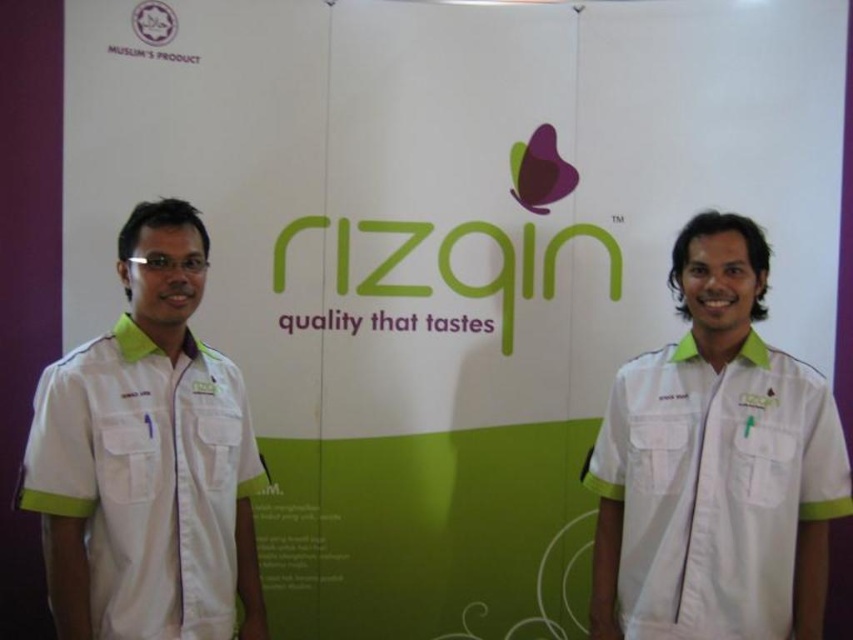
Looking at this image, you are a photographer adjusting your camera to focus on the white fabric shirt at left and the matte plastic logo at upper left. Which object should you focus on first to ensure proper depth of field?

The white fabric shirt at left is closer to the viewer than the matte plastic logo at upper left, so you should focus on the white fabric shirt at left first to ensure proper depth of field.

You are organizing a photoshoot for Rizqin and need to ensure that the white fabric shirt at center and the matte plastic logo at upper left are visible in the frame. Given that the camera has a limited focus range, which object should you prioritize focusing on to ensure clarity?

The white fabric shirt at center should be prioritized for focus because it is bigger than the matte plastic logo at upper left, making it more prominent and requiring clearer visibility in the photoshoot.

You are a photographer adjusting your camera to focus on two points in the scene. The first point is at point (173,547) and the second is at point (164,17). Which point should you focus on first if you want to capture the closest one to the camera?

Point (173,547) is closer to the viewer than point (164,17), so you should focus on point (173,547) first.